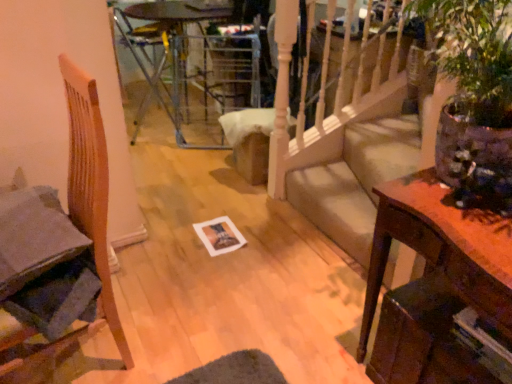
Image resolution: width=512 pixels, height=384 pixels. In order to click on vacant area on the back side of wooden chair at left in this screenshot , I will do `click(151, 288)`.